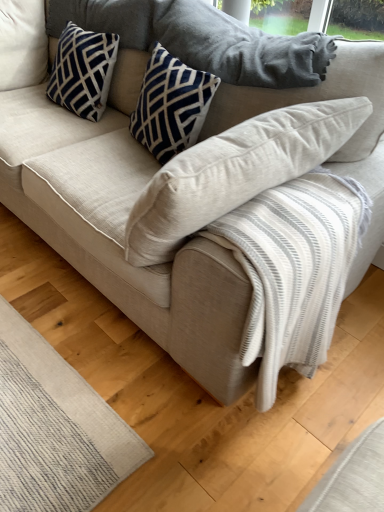
Question: Is point (57, 46) positioned closer to the camera than point (185, 90)?

Choices:
 (A) farther
 (B) closer

Answer: (A)

Question: Is navy blue printed cushion at upper left, which ranks as the 2th pillow in right-to-left order, taller or shorter than navy velvet pillow at upper center, positioned as the 1th pillow in right-to-left order?

Choices:
 (A) tall
 (B) short

Answer: (B)

Question: Is navy blue printed cushion at upper left, the 1th pillow when ordered from left to right, wider or thinner than navy velvet pillow at upper center, which is the 2th pillow from left to right?

Choices:
 (A) wide
 (B) thin

Answer: (A)

Question: Considering the positions of navy velvet pillow at upper center, positioned as the 1th pillow in right-to-left order, and navy blue printed cushion at upper left, the 1th pillow when ordered from left to right, in the image, is navy velvet pillow at upper center, positioned as the 1th pillow in right-to-left order, wider or thinner than navy blue printed cushion at upper left, the 1th pillow when ordered from left to right,?

Choices:
 (A) wide
 (B) thin

Answer: (B)

Question: From a real-world perspective, is navy velvet pillow at upper center, which is the 2th pillow from left to right, positioned above or below navy blue printed cushion at upper left, which ranks as the 2th pillow in right-to-left order?

Choices:
 (A) below
 (B) above

Answer: (B)

Question: Is navy velvet pillow at upper center, which is the 2th pillow from left to right, spatially inside navy blue printed cushion at upper left, the 1th pillow when ordered from left to right, or outside of it?

Choices:
 (A) outside
 (B) inside

Answer: (A)

Question: Is navy velvet pillow at upper center, which is the 2th pillow from left to right, to the left or to the right of navy blue printed cushion at upper left, the 1th pillow when ordered from left to right, in the image?

Choices:
 (A) left
 (B) right

Answer: (B)